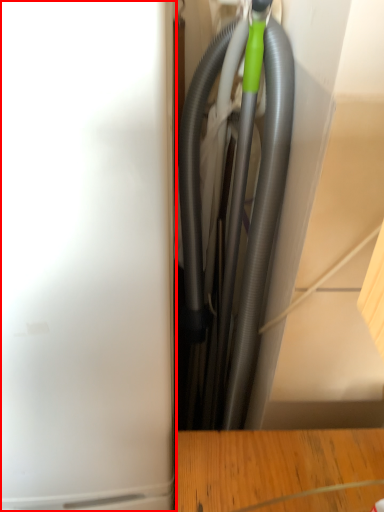
Question: From the image's perspective, what is the correct spatial positioning of appliance (annotated by the red box) in reference to garden hose?

Choices:
 (A) below
 (B) above

Answer: (A)